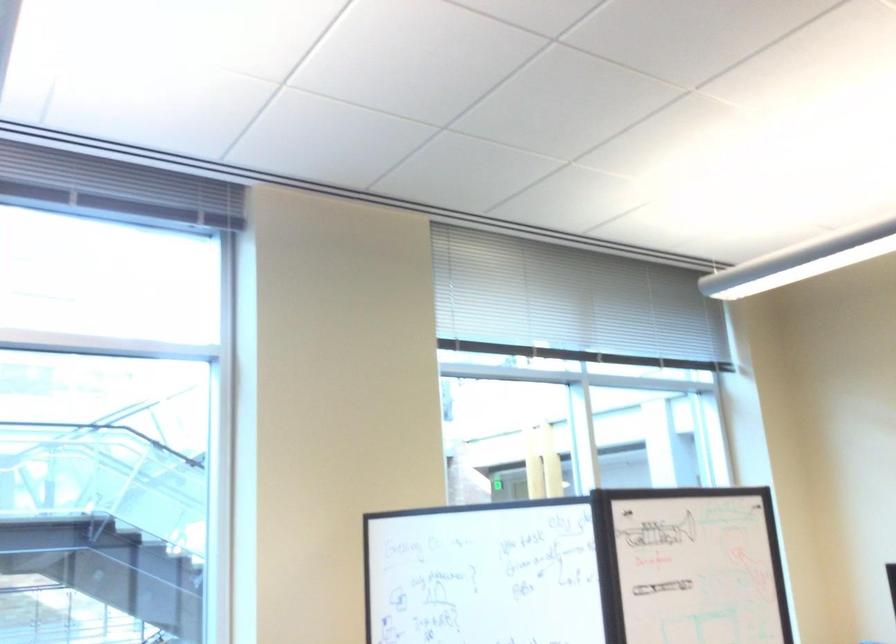
Identify the location of blind pull cord. (227, 370).